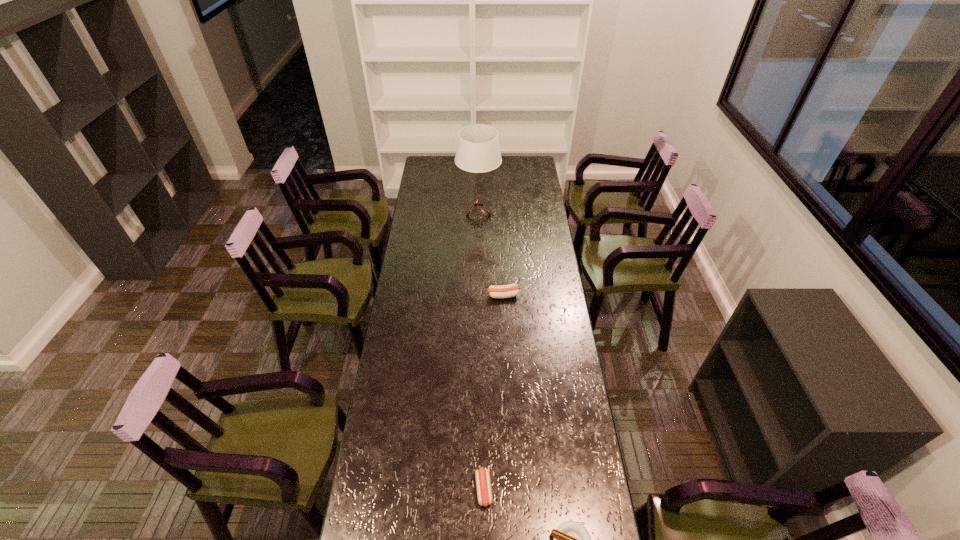
The height and width of the screenshot is (540, 960). Find the location of `the tallest object`. the tallest object is located at coordinates (478, 151).

Where is `table lamp`? table lamp is located at coordinates (478, 151).

Where is `the farthest sausage`? This screenshot has height=540, width=960. the farthest sausage is located at coordinates (505, 291).

Identify the location of the second tallest object. The image size is (960, 540). (505, 291).

I want to click on the third farthest object, so [484, 493].

Find the location of `the third tallest object`. the third tallest object is located at coordinates (484, 493).

Identify the location of free location located on the front-facing side of the tallest object. This screenshot has height=540, width=960. (527, 215).

Where is `blank space located on the front of the farthest sausage`? This screenshot has width=960, height=540. blank space located on the front of the farthest sausage is located at coordinates [x=505, y=335].

At what (x,y) coordinates should I click in order to perform the action: click on free spot located on the left of the second tallest sausage. Please return your answer as a coordinate pair (x, y). This screenshot has height=540, width=960. Looking at the image, I should click on (368, 489).

At what (x,y) coordinates should I click in order to perform the action: click on vacant space at the left edge of the desktop. Please return your answer as a coordinate pair (x, y). Image resolution: width=960 pixels, height=540 pixels. Looking at the image, I should click on (415, 299).